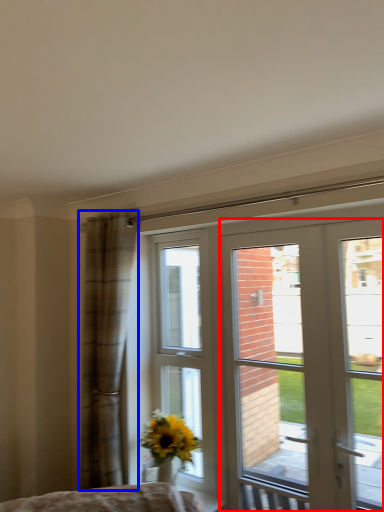
Question: Which object appears farthest to the camera in this image, door (highlighted by a red box) or curtain (highlighted by a blue box)?

Choices:
 (A) door
 (B) curtain

Answer: (B)